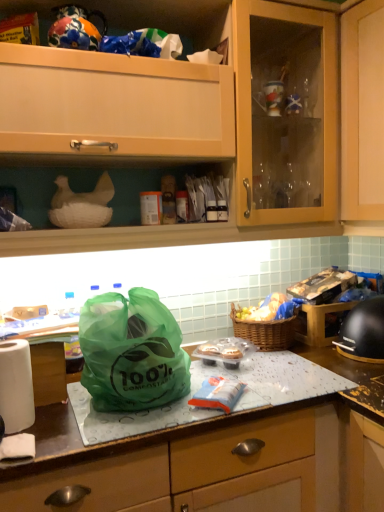
Identify the location of matte wood cabinet at upper center. (137, 148).

Describe the element at coordinates (16, 386) in the screenshot. The image size is (384, 512). I see `white paper towel at left` at that location.

Image resolution: width=384 pixels, height=512 pixels. I want to click on green compostable bag at center, so click(x=132, y=352).

Measure the distance between point (116, 394) and camera.

Point (116, 394) and camera are 1.10 meters apart.

Locate an element on the screen. yellowish matte bread at right is located at coordinates point(268,309).

This screenshot has height=512, width=384. Describe the element at coordinates (364, 332) in the screenshot. I see `black matte helmet at right` at that location.

In order to click on matte wood cabinet at upper center in this screenshot , I will do `click(137, 148)`.

Are white paper towel at left and yellowish matte bread at right beside each other?

No, white paper towel at left is not beside yellowish matte bread at right.

From the image's perspective, does white paper towel at left appear lower than yellowish matte bread at right?

Correct, white paper towel at left appears lower than yellowish matte bread at right in the image.

What's the angular difference between white paper towel at left and yellowish matte bread at right's facing directions?

The angle between the facing direction of white paper towel at left and the facing direction of yellowish matte bread at right is 0.326 degrees.

Is yellowish matte bread at right at the back of white paper towel at left?

No, yellowish matte bread at right is not at the back of white paper towel at left.

Find the location of `home appliance lying in front of the yellowish matte bread at right`. home appliance lying in front of the yellowish matte bread at right is located at coordinates (364, 332).

Is black matte helmet at right positioned far away from yellowish matte bread at right?

Actually, black matte helmet at right and yellowish matte bread at right are a little close together.

Which object is thinner, black matte helmet at right or yellowish matte bread at right?

yellowish matte bread at right.

From the image's perspective, which object appears higher, black matte helmet at right or yellowish matte bread at right?

yellowish matte bread at right, from the image's perspective.

From the image's perspective, is black matte helmet at right on top of green compostable bag at center?

Yes, from the image's perspective, black matte helmet at right is over green compostable bag at center.

Considering the sizes of objects black matte helmet at right and green compostable bag at center in the image provided, who is thinner, black matte helmet at right or green compostable bag at center?

black matte helmet at right.

Considering the positions of objects black matte helmet at right and green compostable bag at center in the image provided, who is more to the right, black matte helmet at right or green compostable bag at center?

black matte helmet at right is more to the right.

Can you confirm if black matte helmet at right is smaller than green compostable bag at center?

Yes, black matte helmet at right is smaller than green compostable bag at center.

Identify the location of plastic bag in front of the yellowish matte bread at right. (132, 352).

From a real-world perspective, between yellowish matte bread at right and green compostable bag at center, who is vertically higher?

green compostable bag at center is physically above.

Does point (268, 302) lie behind point (147, 347)?

That is True.

Would you consider yellowish matte bread at right to be distant from green compostable bag at center?

They are positioned close to each other.

Which is in front, point (238, 319) or point (157, 69)?

The point (157, 69) is closer.

Based on the photo, considering the positions of objects woven brown picnic basket at center and matte wood cabinet at upper center in the image provided, who is behind, woven brown picnic basket at center or matte wood cabinet at upper center?

woven brown picnic basket at center is behind.

Consider the image. Is woven brown picnic basket at center positioned with its back to matte wood cabinet at upper center?

No.

Can you tell me how much woven brown picnic basket at center and matte wood cabinet at upper center differ in facing direction?

woven brown picnic basket at center and matte wood cabinet at upper center are facing 3.46 degrees away from each other.

Is green compostable bag at center next to matte wood cabinet at upper center and touching it?

No, green compostable bag at center is not with matte wood cabinet at upper center.

Is green compostable bag at center facing away from matte wood cabinet at upper center?

That's not correct — green compostable bag at center is not looking away from matte wood cabinet at upper center.

Is green compostable bag at center to the left or to the right of matte wood cabinet at upper center in the image?

green compostable bag at center is to the left of matte wood cabinet at upper center.

Does point (47, 442) come closer to viewer compared to point (260, 309)?

Yes, point (47, 442) is in front of point (260, 309).

In the scene shown: Can you tell me how much matte plastic bag at center and yellowish matte bread at right differ in facing direction?

The angular difference between matte plastic bag at center and yellowish matte bread at right is 3.47 degrees.

Looking at this image, is matte plastic bag at center positioned far away from yellowish matte bread at right?

That's not correct — matte plastic bag at center is a little close to yellowish matte bread at right.

Does matte plastic bag at center have a greater width compared to yellowish matte bread at right?

Indeed, matte plastic bag at center has a greater width compared to yellowish matte bread at right.

Locate an element on the screen. The width and height of the screenshot is (384, 512). kitchen appliance in front of the yellowish matte bread at right is located at coordinates (16, 386).

At what (x,y) coordinates should I click in order to perform the action: click on home appliance located underneath the yellowish matte bread at right (from a real-world perspective). Please return your answer as a coordinate pair (x, y). Looking at the image, I should click on (364, 332).

From the image, which object appears to be nearer to green compostable bag at center, black matte helmet at right or matte wood cabinet at upper center?

The object closer to green compostable bag at center is matte wood cabinet at upper center.

Based on their spatial positions, is white paper towel at left or yellowish matte bread at right further from matte wood cabinet at upper center?

yellowish matte bread at right lies further to matte wood cabinet at upper center than the other object.

When comparing their distances from matte wood cabinet at upper center, does matte plastic bag at center or black matte helmet at right seem further?

Among the two, black matte helmet at right is located further to matte wood cabinet at upper center.

From the image, which object appears to be farther from woven brown picnic basket at center, green compostable bag at center or black matte helmet at right?

The object further to woven brown picnic basket at center is green compostable bag at center.

Estimate the real-world distances between objects in this image. Which object is closer to matte plastic bag at center, black matte helmet at right or woven brown picnic basket at center?

black matte helmet at right is positioned closer to the anchor matte plastic bag at center.

Considering their positions, is matte wood cabinet at upper center positioned closer to matte plastic bag at center than black matte helmet at right?

Among the two, black matte helmet at right is located nearer to matte plastic bag at center.

Based on their spatial positions, is black matte helmet at right or matte wood cabinet at upper center closer to yellowish matte bread at right?

Among the two, black matte helmet at right is located nearer to yellowish matte bread at right.

Estimate the real-world distances between objects in this image. Which object is closer to matte plastic bag at center, green compostable bag at center or woven brown picnic basket at center?

Based on the image, green compostable bag at center appears to be nearer to matte plastic bag at center.

The width and height of the screenshot is (384, 512). Identify the location of picnic basket located between white paper towel at left and yellowish matte bread at right in the left-right direction. (265, 331).

Find the location of `plastic bag between matte plastic bag at center and yellowish matte bread at right along the z-axis`. plastic bag between matte plastic bag at center and yellowish matte bread at right along the z-axis is located at coordinates (132, 352).

The width and height of the screenshot is (384, 512). Identify the location of plastic bag between matte wood cabinet at upper center and woven brown picnic basket at center vertically. tap(132, 352).

You are a GUI agent. You are given a task and a screenshot of the screen. Output one action in this format:
    pyautogui.click(x=<x>, y=<y>)
    Task: Click on the food between matte wood cabinet at upper center and green compostable bag at center vertically
    The height and width of the screenshot is (512, 384).
    Given the screenshot: What is the action you would take?
    pyautogui.click(x=268, y=309)